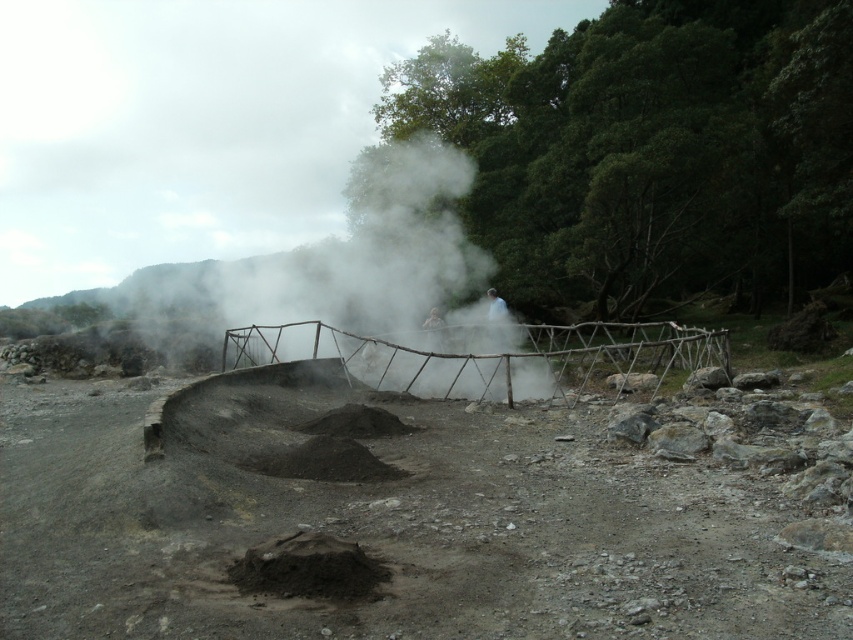
From the picture: Measure the distance from dull gray dirt track at center to white vapor at center.

28.66 feet

Is dull gray dirt track at center to the left of white vapor at center from the viewer's perspective?

Incorrect, dull gray dirt track at center is not on the left side of white vapor at center.

Is point (180, 403) closer to camera compared to point (401, 237)?

Yes, point (180, 403) is closer to viewer.

Image resolution: width=853 pixels, height=640 pixels. In order to click on dull gray dirt track at center in this screenshot , I will do `click(410, 516)`.

Is dull gray dirt track at center behind dark gray ash at center?

No, it is in front of dark gray ash at center.

Who is more distant from viewer, (798, 531) or (370, 452)?

Positioned behind is point (370, 452).

What are the coordinates of `dull gray dirt track at center` in the screenshot? It's located at point(410,516).

Can you confirm if white vapor at center is shorter than dark gray ash at center?

No, white vapor at center is not shorter than dark gray ash at center.

Based on the photo, between white vapor at center and dark gray ash at center, which one is positioned higher?

white vapor at center is higher up.

Who is more distant from viewer, (433,314) or (149,436)?

Positioned behind is point (433,314).

Identify the location of white vapor at center. (387, 285).